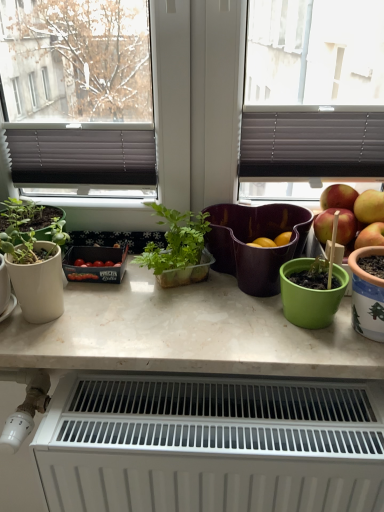
Question: Is white matte radiator at lower center wider or thinner than translucent plastic plant at center?

Choices:
 (A) thin
 (B) wide

Answer: (B)

Question: Considering their positions, is white matte radiator at lower center located in front of or behind translucent plastic plant at center?

Choices:
 (A) behind
 (B) front

Answer: (B)

Question: Considering the real-world distances, which object is farthest from the white matte radiator at lower center?

Choices:
 (A) translucent plastic plant at center
 (B) white marble countertop at center
 (C) white ceramic pot at right, acting as the 1th flowerpot starting from the front
 (D) matte purple flowerpot at center, arranged as the second flowerpot when viewed from the front

Answer: (A)

Question: Based on their relative distances, which object is nearer to the matte purple flowerpot at center, arranged as the second flowerpot when viewed from the front?

Choices:
 (A) white ceramic pot at right, arranged as the 2th flowerpot when viewed from the left
 (B) white matte radiator at lower center
 (C) white marble countertop at center
 (D) translucent plastic plant at center

Answer: (D)